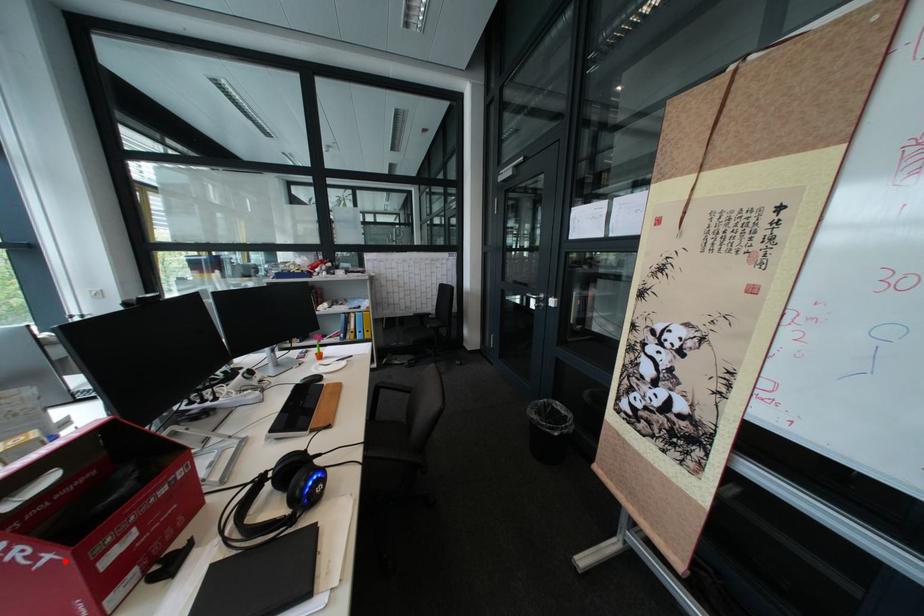
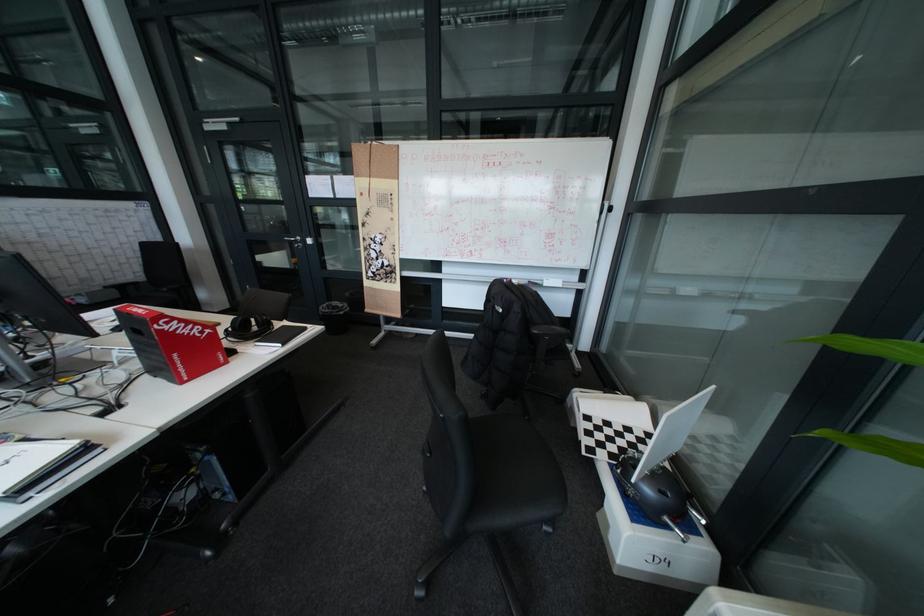
Where in the second image is the point corresponding to the highlighted location from the first image?

(223, 333)